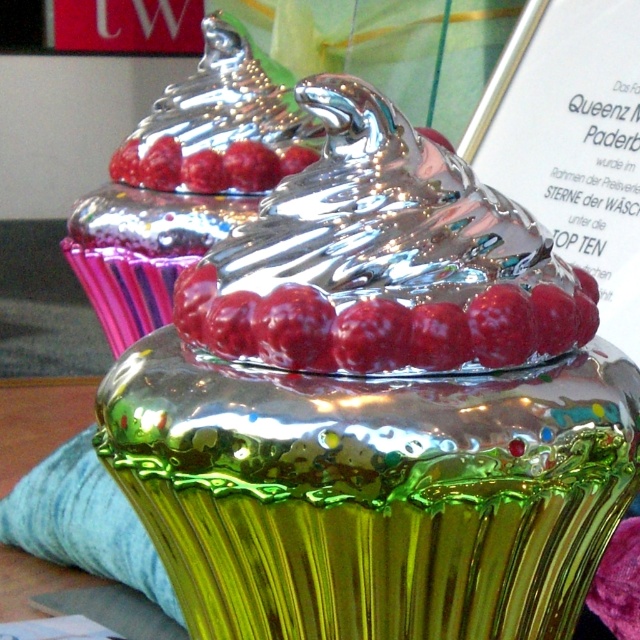
Question: Which point is closer to the camera taking this photo?

Choices:
 (A) (461, 355)
 (B) (144, 173)

Answer: (A)

Question: Can you confirm if shiny metallic muffin at center is positioned below shiny metallic raspberry at center?

Choices:
 (A) yes
 (B) no

Answer: (B)

Question: Does shiny metallic muffin at center appear on the right side of shiny metallic raspberry at center?

Choices:
 (A) no
 (B) yes

Answer: (A)

Question: Which point is closer to the camera taking this photo?

Choices:
 (A) (276, 147)
 (B) (552, 321)

Answer: (B)

Question: Can you confirm if shiny metallic muffin at center is bigger than shiny metallic raspberry at center?

Choices:
 (A) no
 (B) yes

Answer: (B)